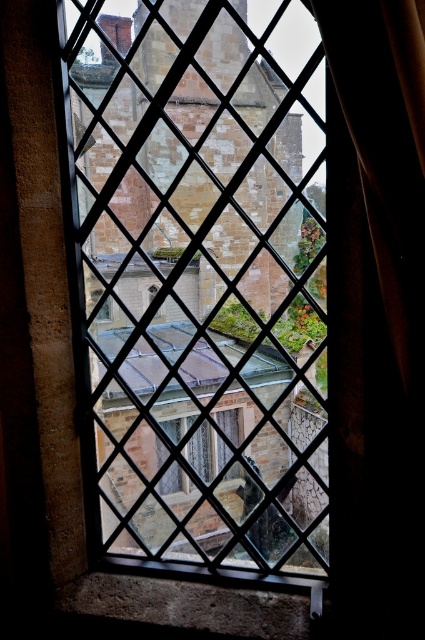
Can you confirm if brown stone tower at center is shorter than black fabric curtain at right?

In fact, brown stone tower at center may be taller than black fabric curtain at right.

Is the position of brown stone tower at center less distant than that of black fabric curtain at right?

No, brown stone tower at center is behind black fabric curtain at right.

What do you see at coordinates (200, 285) in the screenshot? I see `brown stone tower at center` at bounding box center [200, 285].

I want to click on brown stone tower at center, so click(x=200, y=285).

Does brown stone tower at center have a greater height compared to clear glass window at center?

Yes.

Is brown stone tower at center shorter than clear glass window at center?

Incorrect, brown stone tower at center's height does not fall short of clear glass window at center's.

Where is `brown stone tower at center`? The image size is (425, 640). brown stone tower at center is located at coordinates (200, 285).

Is black fabric curtain at right behind clear glass window at center?

No, black fabric curtain at right is in front of clear glass window at center.

Is point (385, 253) positioned behind point (227, 435)?

That is False.

Which is in front, point (379, 131) or point (201, 460)?

Point (379, 131)

The width and height of the screenshot is (425, 640). I want to click on black fabric curtain at right, so coord(387,150).